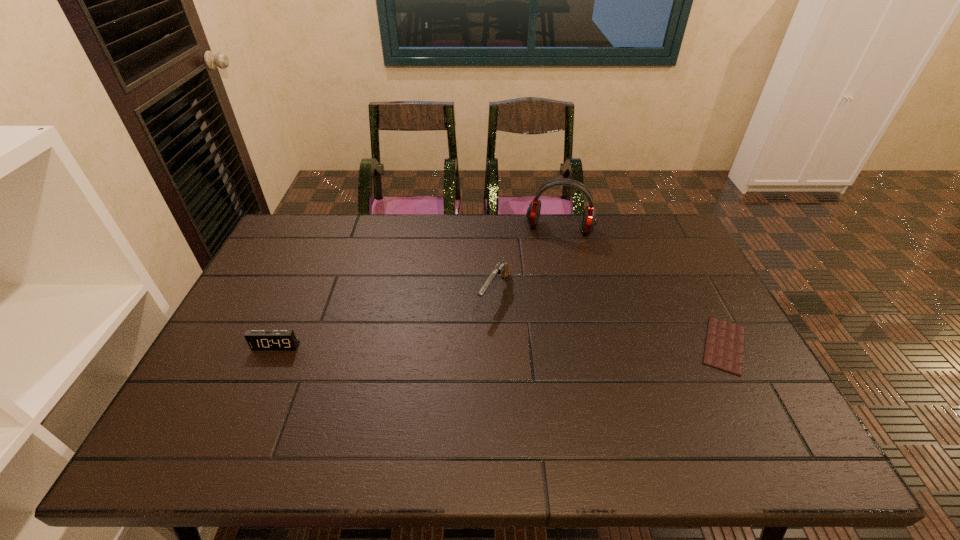
This screenshot has height=540, width=960. Identify the location of vacant space in between the third object from right to left and the second shortest object. (385, 319).

Find the location of a particular element. vacant area between the tallest object and the shortest object is located at coordinates (642, 287).

Locate an element on the screen. object that is the third closest to the second object from left to right is located at coordinates (257, 339).

Locate an element on the screen. This screenshot has height=540, width=960. the third closest object to the tallest object is located at coordinates (257, 339).